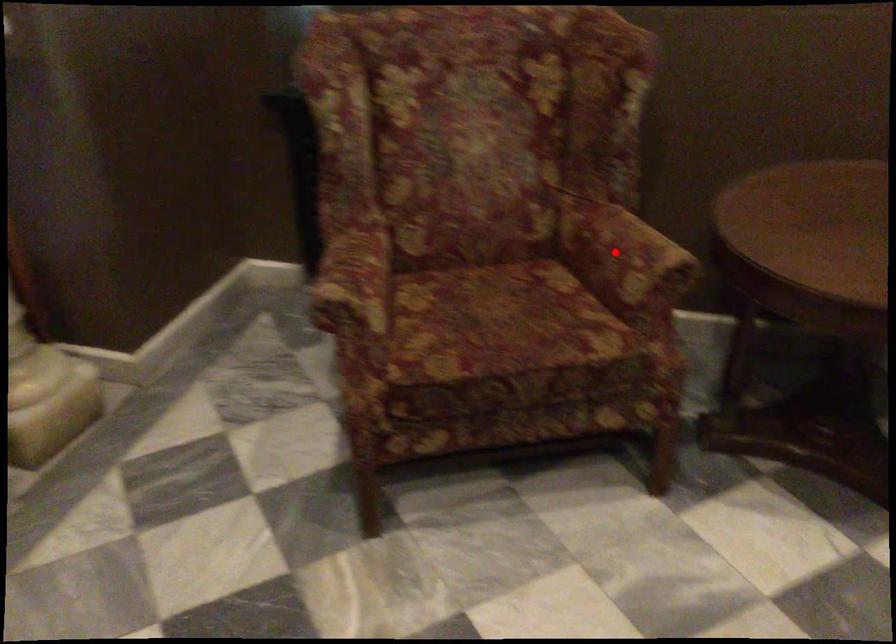
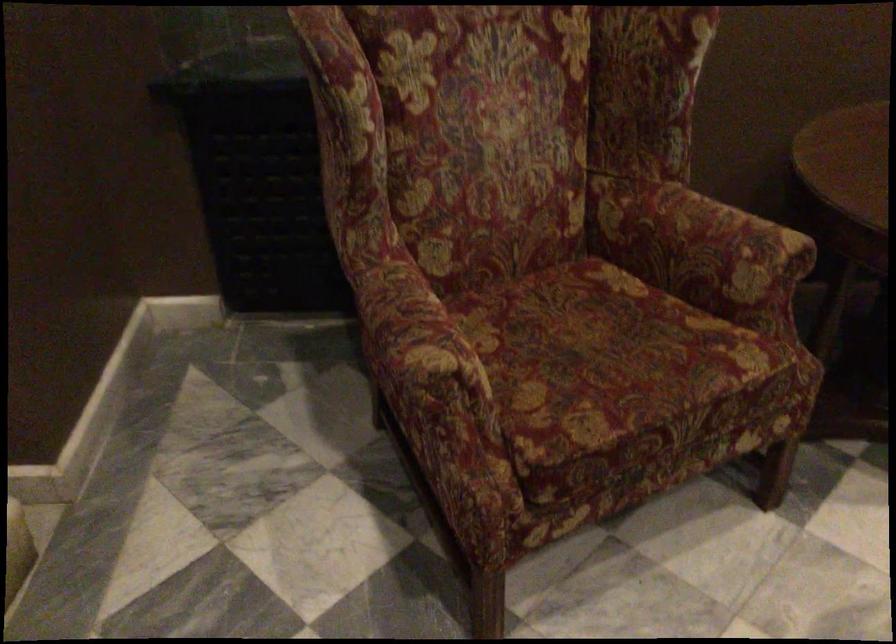
Where in the second image is the point corresponding to the highlighted location from the first image?

(700, 243)